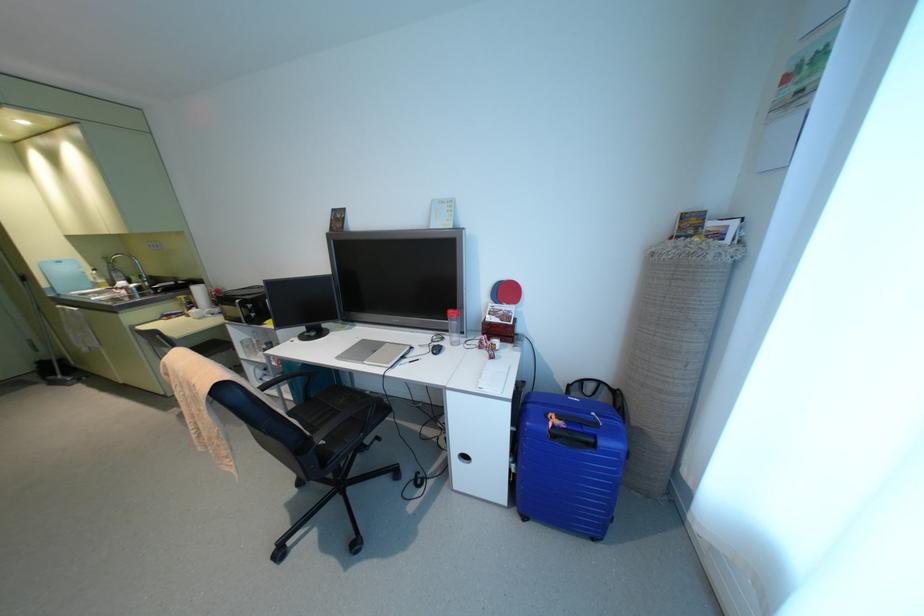
In order to click on metal cabinet handle in this screenshot , I will do point(464,456).